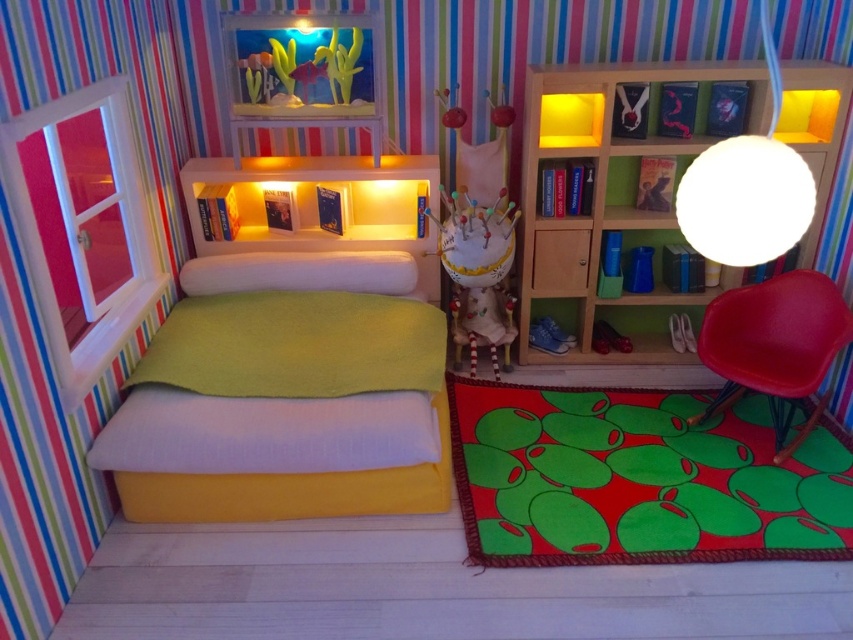
Which is in front, point (190, 214) or point (618, 307)?

Point (190, 214)

Is matte green fabric bed at center closer to camera compared to wooden bookshelf at upper right?

No.

Where is `matte green fabric bed at center`? This screenshot has height=640, width=853. matte green fabric bed at center is located at coordinates (276, 456).

Where is `matte green fabric bed at center`? The image size is (853, 640). matte green fabric bed at center is located at coordinates (276, 456).

Between wooden bookshelf at upper right and white fabric doll at center, which one appears on the right side from the viewer's perspective?

Positioned to the right is wooden bookshelf at upper right.

This screenshot has width=853, height=640. Identify the location of wooden bookshelf at upper right. (607, 198).

Between point (525, 164) and point (492, 262), which one is positioned behind?

The point (525, 164) is behind.

Locate an element on the screen. wooden bookshelf at upper right is located at coordinates (607, 198).

Between matte green fabric bed at center and white fabric doll at center, which one is positioned lower?

Positioned lower is white fabric doll at center.

Is matte green fabric bed at center to the right of white fabric doll at center from the viewer's perspective?

In fact, matte green fabric bed at center is to the left of white fabric doll at center.

Is point (271, 186) in front of point (453, 262)?

No, it is not.

Locate an element on the screen. The height and width of the screenshot is (640, 853). matte green fabric bed at center is located at coordinates (276, 456).